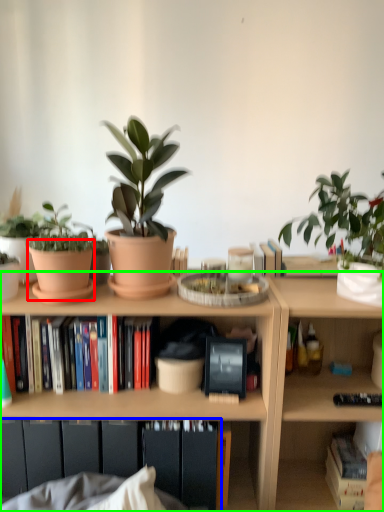
Question: Estimate the real-world distances between objects in this image. Which object is farther from flowerpot (highlighted by a red box), cabinet (highlighted by a blue box) or bookcase (highlighted by a green box)?

Choices:
 (A) cabinet
 (B) bookcase

Answer: (A)